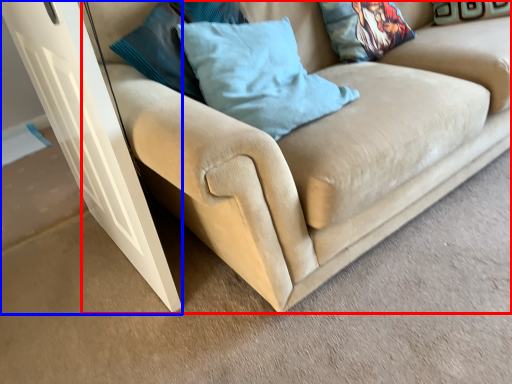
Question: Which point is further to the camera, studio couch (highlighted by a red box) or glass door (highlighted by a blue box)?

Choices:
 (A) studio couch
 (B) glass door

Answer: (B)